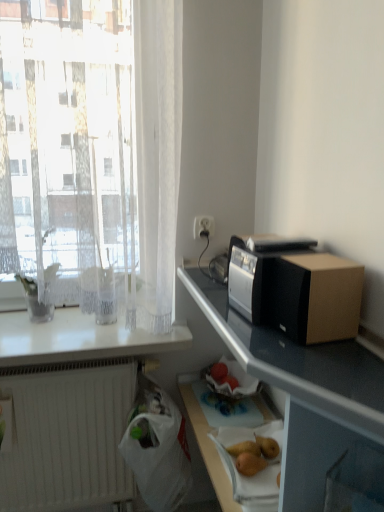
Where is `empty space that is ontop of white matte radiator at lower left (from a real-world perspective)`? empty space that is ontop of white matte radiator at lower left (from a real-world perspective) is located at coordinates (69, 361).